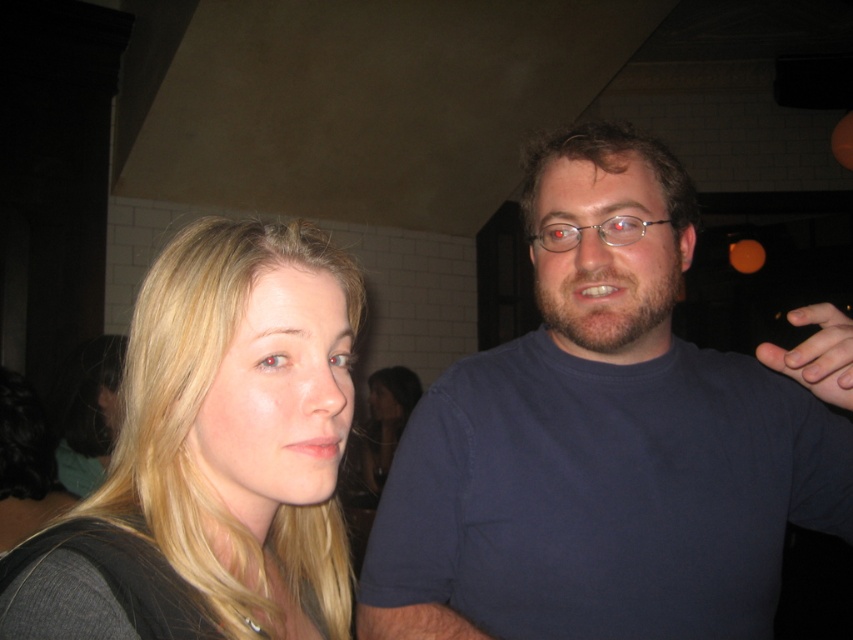
Is point (329, 273) farther from viewer compared to point (809, 346)?

No, (329, 273) is closer to viewer.

Where is `blonde hair at left`? This screenshot has width=853, height=640. blonde hair at left is located at coordinates (213, 454).

Can you confirm if blue cotton shirt at right is bigger than blonde hair at left?

Indeed, blue cotton shirt at right has a larger size compared to blonde hair at left.

Does point (521, 358) come farther from viewer compared to point (248, 554)?

Yes, point (521, 358) is farther from viewer.

Which is in front, point (550, 253) or point (178, 356)?

Point (178, 356) is more forward.

The width and height of the screenshot is (853, 640). What are the coordinates of `blue cotton shirt at right` in the screenshot? It's located at (601, 442).

Can you confirm if blue cotton shirt at right is bigger than smooth skin hand at right?

Yes.

Looking at this image, is blue cotton shirt at right closer to the viewer compared to smooth skin hand at right?

No, blue cotton shirt at right is behind smooth skin hand at right.

In order to click on blue cotton shirt at right in this screenshot , I will do `click(601, 442)`.

Locate an element on the screen. This screenshot has width=853, height=640. blue cotton shirt at right is located at coordinates (601, 442).